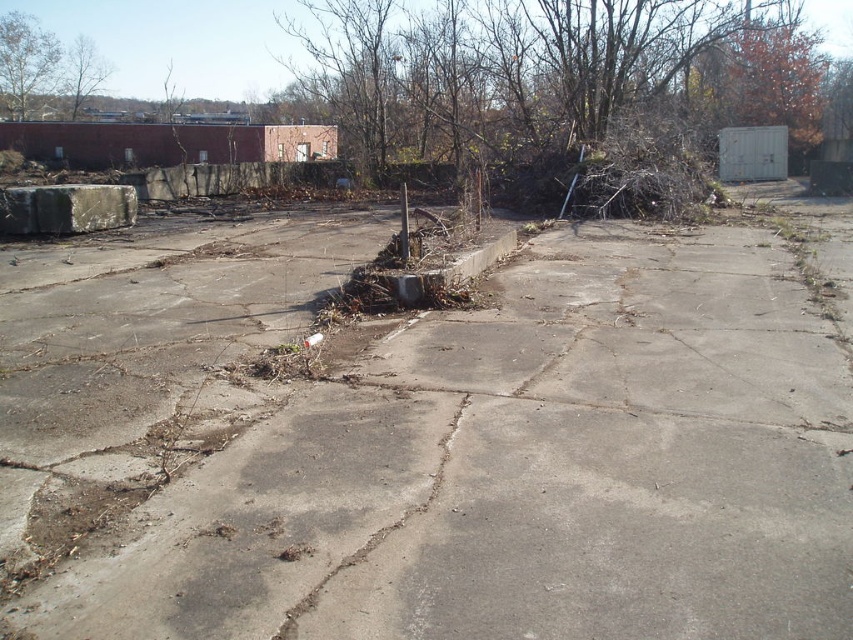
Question: Can you confirm if gray concrete pavement at center is wider than brown leafy tree at upper left?

Choices:
 (A) no
 (B) yes

Answer: (B)

Question: Can you confirm if gray concrete pavement at center is positioned above brown/dry leaves at upper center?

Choices:
 (A) no
 (B) yes

Answer: (A)

Question: Which of these objects is positioned farthest from the gray concrete block at left?

Choices:
 (A) gray concrete pavement at center
 (B) green leafy tree at upper left
 (C) brown/dry leaves at upper center

Answer: (B)

Question: Can you confirm if gray concrete block at left is wider than green leafy tree at upper left?

Choices:
 (A) yes
 (B) no

Answer: (A)

Question: Considering the real-world distances, which object is closest to the gray concrete pavement at center?

Choices:
 (A) green leafy tree at upper left
 (B) brown leafy tree at upper left

Answer: (B)

Question: Which point is farther to the camera?

Choices:
 (A) 65,72
 (B) 85,216
 (C) 592,403

Answer: (A)